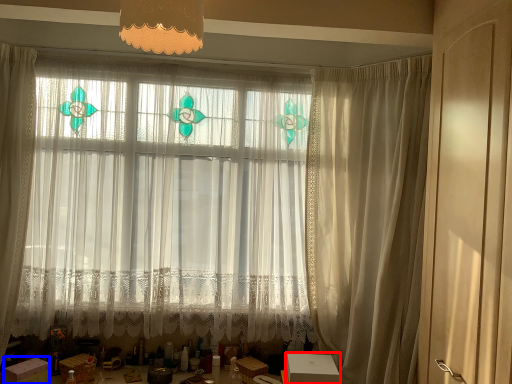
Question: Which point is further to the camera, cardboard box (highlighted by a red box) or cardboard box (highlighted by a blue box)?

Choices:
 (A) cardboard box
 (B) cardboard box

Answer: (A)